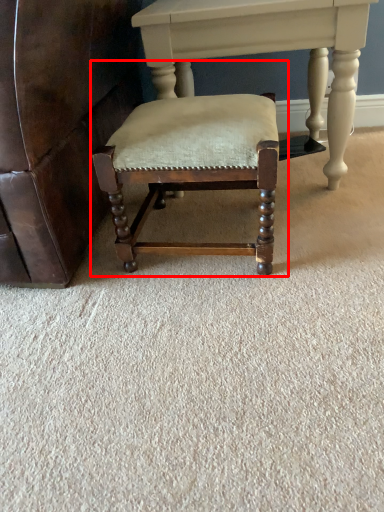
Question: In this image, where is chair (annotated by the red box) located relative to table?

Choices:
 (A) right
 (B) left

Answer: (B)